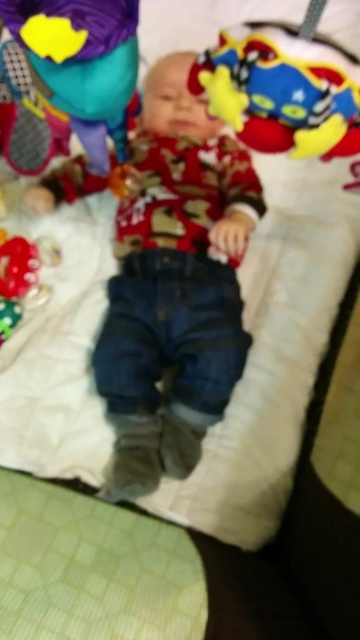
You are a parent looking at the baby and the toys. Which toy is located to the right of the other between the soft plush toy at upper right and the matte green plush toy at upper left?

The soft plush toy at upper right is positioned on the right side of the matte green plush toy at upper left.

You are a parent looking at the baby in the image. You want to give the baby a soft plush toy located at point (280, 96). Where should you reach to give the baby the soft plush toy?

The point (280, 96) indicates the soft plush toy at upper right, so you should reach towards the upper right to give the baby the soft plush toy.

You are taking a photo of the baby and want to focus on the point at the bottom left corner of the image. Which point, point at (339, 81) or point at (65, 12), is closer to the camera and should be in focus?

Point at (339, 81) is closer to the camera than point at (65, 12), so it should be in focus.